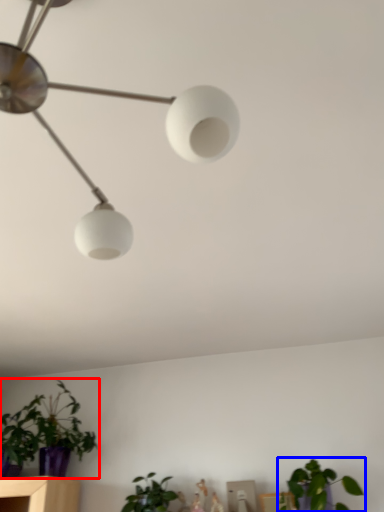
Question: Which point is further to the camera, houseplant (highlighted by a red box) or houseplant (highlighted by a blue box)?

Choices:
 (A) houseplant
 (B) houseplant

Answer: (A)